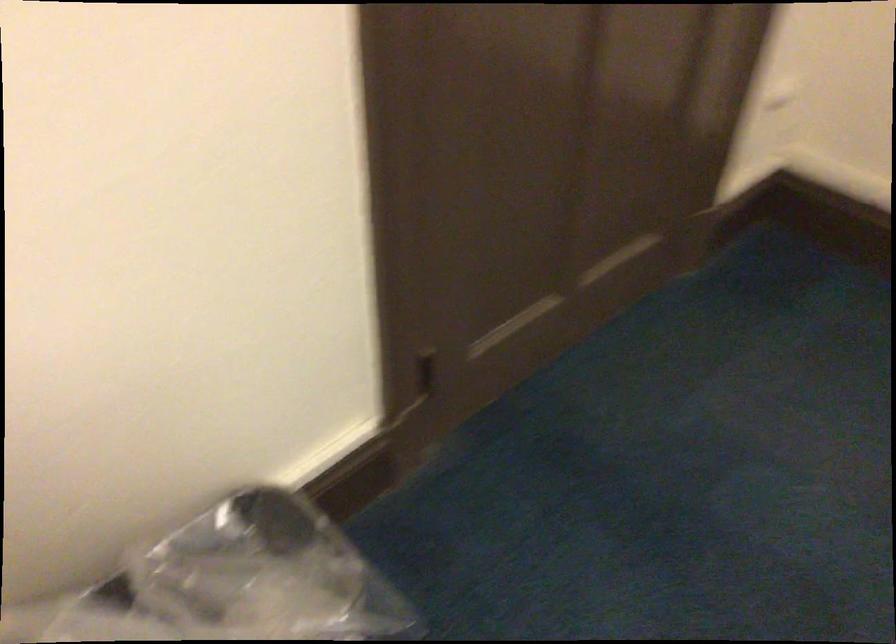
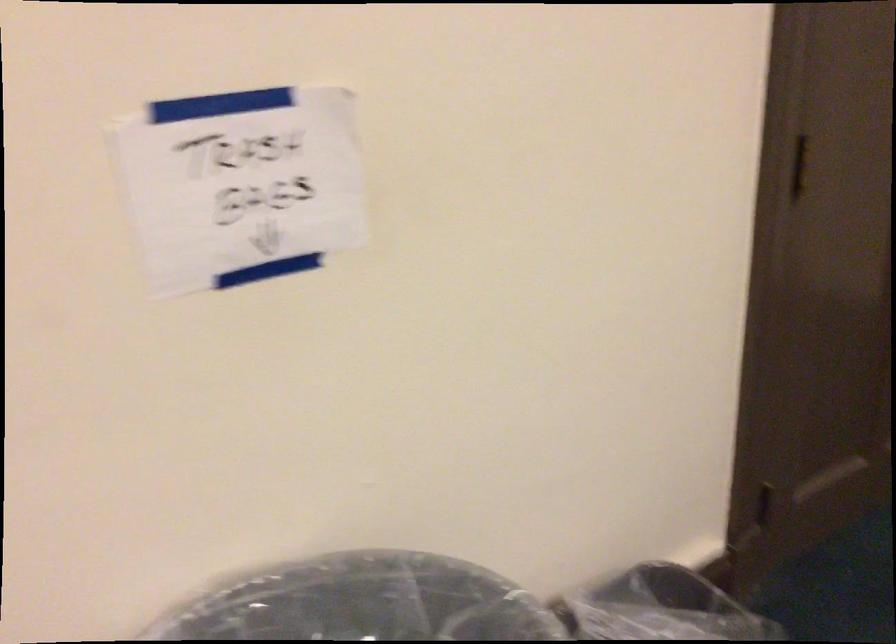
Question: Based on the continuous images, in which direction is the camera rotating? Reply with the corresponding letter.

Choices:
 (A) Left
 (B) Right
 (C) Up
 (D) Down

Answer: (C)